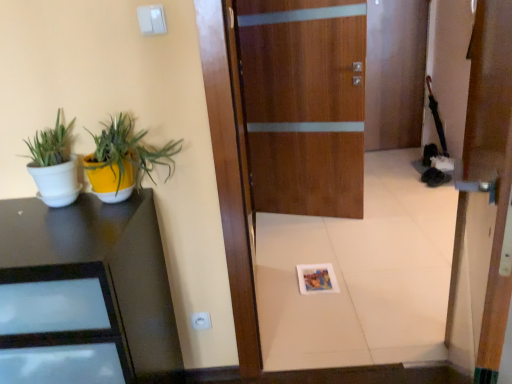
Question: Considering the positions of white matte pot at left, the first houseplant from the left, and black glossy desk at left in the image, is white matte pot at left, the first houseplant from the left, wider or thinner than black glossy desk at left?

Choices:
 (A) thin
 (B) wide

Answer: (A)

Question: From the image's perspective, is white matte pot at left, which is the second houseplant in right-to-left order, above or below black glossy desk at left?

Choices:
 (A) below
 (B) above

Answer: (B)

Question: Which object is the farthest from the wooden door at center, the 1th door in the back-to-front sequence?

Choices:
 (A) yellow matte pot at left, which appears as the first houseplant when viewed from the right
 (B) wooden door at center, arranged as the second door when viewed from the back
 (C) white plastic electric outlet at lower center
 (D) black glossy desk at left
 (E) white matte pot at left, the first houseplant from the left

Answer: (E)

Question: Considering the real-world distances, which object is farthest from the wooden door at center, arranged as the second door when viewed from the back?

Choices:
 (A) white matte pot at left, which is the second houseplant in right-to-left order
 (B) white plastic electric outlet at lower center
 (C) wooden door at center, marked as the second door in a front-to-back arrangement
 (D) black glossy desk at left
 (E) yellow matte pot at left, which appears as the first houseplant when viewed from the right

Answer: (C)